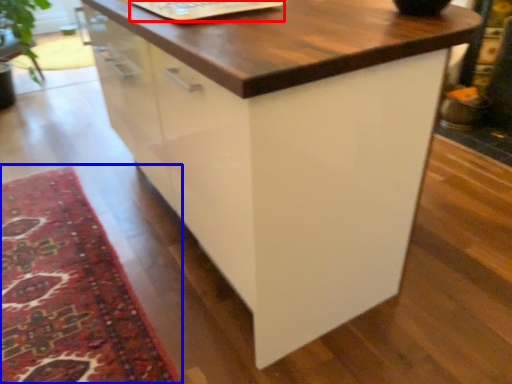
Question: Which object is closer to the camera taking this photo, laptop keyboard (highlighted by a red box) or mat (highlighted by a blue box)?

Choices:
 (A) laptop keyboard
 (B) mat

Answer: (B)